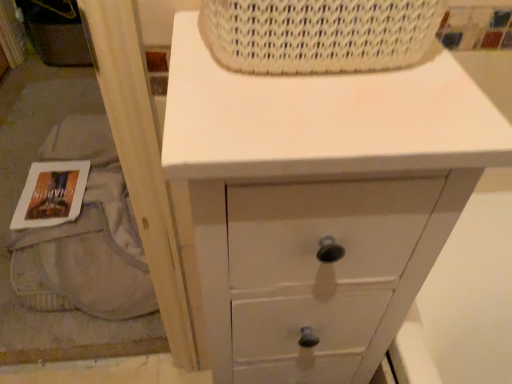
The image size is (512, 384). I want to click on free space above white painted wood chest of drawers at upper center (from a real-world perspective), so click(320, 93).